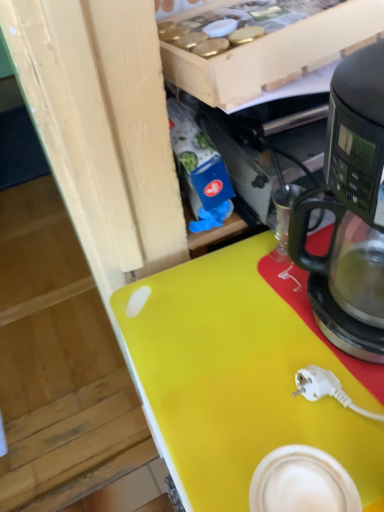
Measure the distance between point [380,118] and camera.

A distance of 35.90 centimeters exists between point [380,118] and camera.

At what (x,y) coordinates should I click in order to perform the action: click on black matte coffee maker at right. Please return your answer as a coordinate pair (x, y). Looking at the image, I should click on (350, 211).

In order to face black matte coffee maker at right, should I rotate leftwards or rightwards?

Turn right by 26.446 degrees to look at black matte coffee maker at right.

Describe the element at coordinates (350, 211) in the screenshot. The image size is (384, 512). I see `black matte coffee maker at right` at that location.

The image size is (384, 512). Describe the element at coordinates (238, 379) in the screenshot. I see `yellow matte desk at center` at that location.

In order to face yellow matte desk at center, should I rotate leftwards or rightwards?

To face it directly, rotate right by 13.112 degrees.

Find the location of a particular element. The image size is (384, 512). yellow matte desk at center is located at coordinates [238, 379].

Find the location of a particular element. The width and height of the screenshot is (384, 512). black matte coffee maker at right is located at coordinates (350, 211).

Between yellow matte desk at center and black matte coffee maker at right, which one appears on the left side from the viewer's perspective?

From the viewer's perspective, yellow matte desk at center appears more on the left side.

Based on the photo, is yellow matte desk at center further to camera compared to black matte coffee maker at right?

Yes, yellow matte desk at center is behind black matte coffee maker at right.

Is point (234, 449) farther from camera compared to point (304, 221)?

No, (234, 449) is in front of (304, 221).

From the image's perspective, does yellow matte desk at center appear lower than black matte coffee maker at right?

Yes, from the image's perspective, yellow matte desk at center is beneath black matte coffee maker at right.

From a real-world perspective, who is located lower, yellow matte desk at center or black matte coffee maker at right?

yellow matte desk at center is physically lower.

Considering the sizes of yellow matte desk at center and black matte coffee maker at right in the image, is yellow matte desk at center wider or thinner than black matte coffee maker at right?

In the image, yellow matte desk at center appears to be wider than black matte coffee maker at right.

Which of these two, yellow matte desk at center or black matte coffee maker at right, stands shorter?

black matte coffee maker at right is shorter.

Looking at the image, does yellow matte desk at center seem bigger or smaller compared to black matte coffee maker at right?

Clearly, yellow matte desk at center is larger in size than black matte coffee maker at right.

Is yellow matte desk at center outside of black matte coffee maker at right?

Yes, yellow matte desk at center is outside of black matte coffee maker at right.

Are yellow matte desk at center and black matte coffee maker at right far apart?

No, yellow matte desk at center is not far from black matte coffee maker at right.

Is yellow matte desk at center oriented away from black matte coffee maker at right?

That's not correct — yellow matte desk at center is not looking away from black matte coffee maker at right.

Image resolution: width=384 pixels, height=512 pixels. Identify the location of desk that appears below the black matte coffee maker at right (from a real-world perspective). (238, 379).

Is black matte coffee maker at right to the left of yellow matte desk at center from the viewer's perspective?

No, black matte coffee maker at right is not to the left of yellow matte desk at center.

Is black matte coffee maker at right further to the viewer compared to yellow matte desk at center?

No, black matte coffee maker at right is closer to the camera.

Considering the points (334, 302) and (308, 402), which point is behind, point (334, 302) or point (308, 402)?

The point (334, 302) is behind.

From the image's perspective, is black matte coffee maker at right on yellow matte desk at center?

Indeed, from the image's perspective, black matte coffee maker at right is shown above yellow matte desk at center.

From a real-world perspective, which object rests below the other?

→ From a 3D spatial view, yellow matte desk at center is below.

Is black matte coffee maker at right wider or thinner than yellow matte desk at center?

Clearly, black matte coffee maker at right has less width compared to yellow matte desk at center.

From the picture: Is black matte coffee maker at right taller than yellow matte desk at center?

No, black matte coffee maker at right is not taller than yellow matte desk at center.

Which of these two, black matte coffee maker at right or yellow matte desk at center, is bigger?

yellow matte desk at center is bigger.

Does black matte coffee maker at right contain yellow matte desk at center?

No, yellow matte desk at center is not a part of black matte coffee maker at right.

Are black matte coffee maker at right and yellow matte desk at center far apart?

No, black matte coffee maker at right is not far away from yellow matte desk at center.

Is black matte coffee maker at right turned away from yellow matte desk at center?

That's not correct — black matte coffee maker at right is not looking away from yellow matte desk at center.

Can you tell me how much black matte coffee maker at right and yellow matte desk at center differ in facing direction?

The angular difference between black matte coffee maker at right and yellow matte desk at center is 3.31 degrees.

The height and width of the screenshot is (512, 384). I want to click on desk beneath the black matte coffee maker at right (from a real-world perspective), so click(x=238, y=379).

Identify the location of coffee maker located in front of the yellow matte desk at center. This screenshot has width=384, height=512. (350, 211).

Locate an element on the screen. desk below the black matte coffee maker at right (from the image's perspective) is located at coordinates (238, 379).